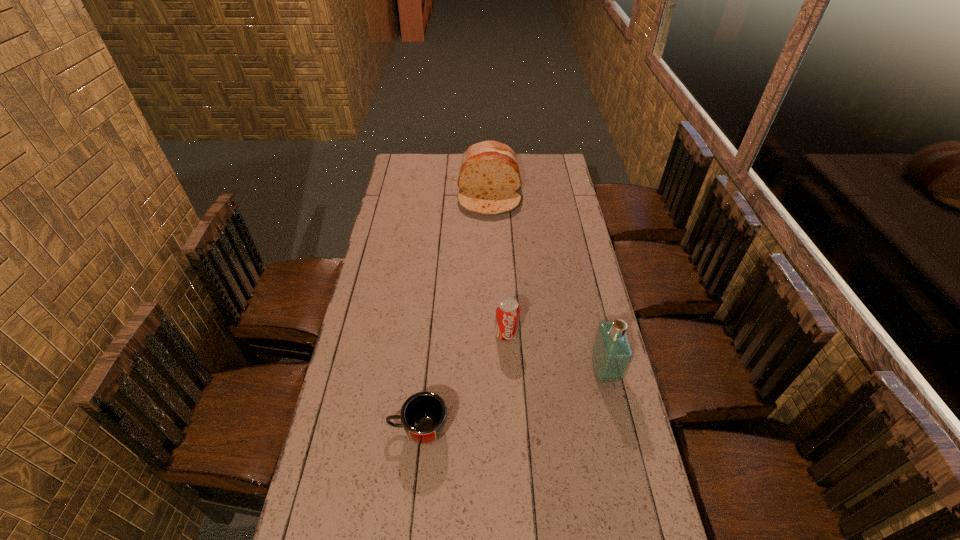
Locate an element on the screen. This screenshot has height=540, width=960. vacant space on the desktop that is between the shortest object and the tallest object and is positioned on the logo side of the second farthest object is located at coordinates 513,400.

Where is `free space on the desktop that is between the mug and the perfume and is positioned at the sliced end of the farthest object`? Image resolution: width=960 pixels, height=540 pixels. free space on the desktop that is between the mug and the perfume and is positioned at the sliced end of the farthest object is located at coordinates (490, 407).